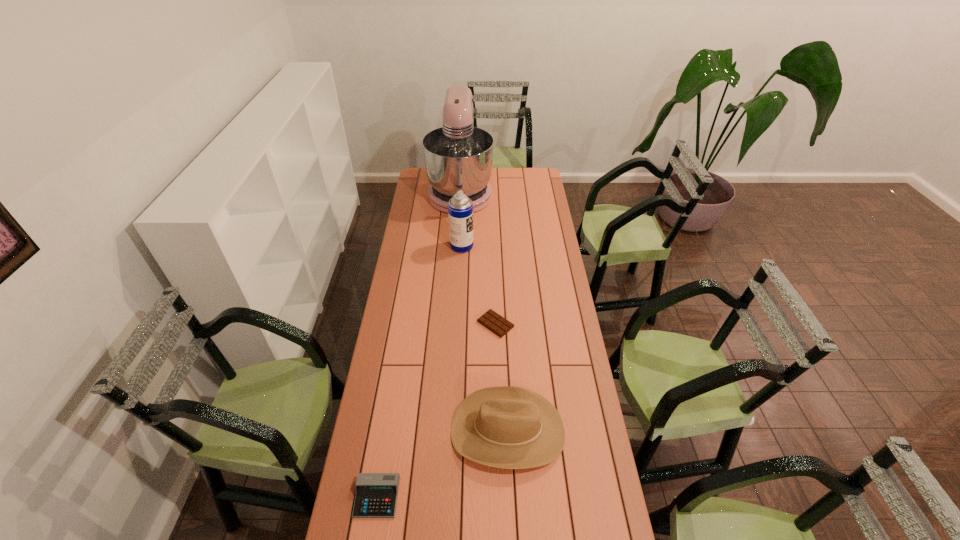
Locate an element on the screen. vacant space at the far edge of the desktop is located at coordinates [515, 172].

Where is `vacant space at the left edge of the desktop`? The image size is (960, 540). vacant space at the left edge of the desktop is located at coordinates (431, 260).

Find the location of `vacant area at the right edge of the desktop`. vacant area at the right edge of the desktop is located at coordinates (586, 430).

Image resolution: width=960 pixels, height=540 pixels. Find the location of `vacant space at the far right corner of the desktop`. vacant space at the far right corner of the desktop is located at coordinates (536, 181).

You are a GUI agent. You are given a task and a screenshot of the screen. Output one action in this format:
    pyautogui.click(x=<x>, y=<y>)
    Task: Click on the vacant area between the candy bar and the second nearest object
    The width and height of the screenshot is (960, 540).
    Given the screenshot: What is the action you would take?
    pyautogui.click(x=501, y=377)

I want to click on free space that is in between the fourth farthest object and the tallest object, so click(x=484, y=312).

Locate an element on the screen. unoccupied area between the second farthest object and the calculator is located at coordinates (420, 372).

The height and width of the screenshot is (540, 960). In order to click on free spot between the fourth nearest object and the second nearest object in this screenshot , I will do `click(485, 338)`.

Identify the location of free space that is in between the candy bar and the aerosol can. (479, 285).

This screenshot has height=540, width=960. In order to click on vacant space in between the calculator and the second nearest object in this screenshot , I will do `click(443, 464)`.